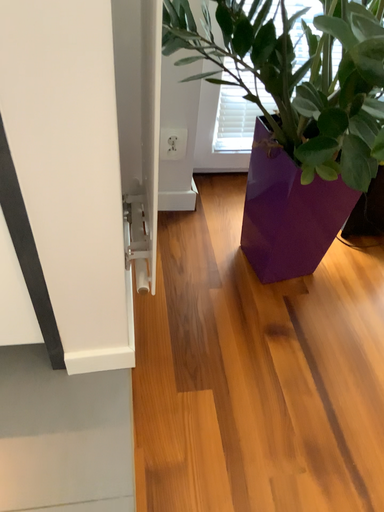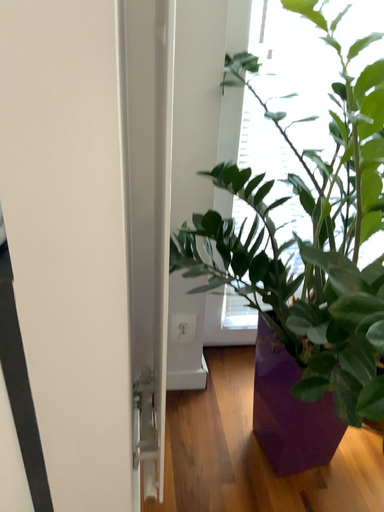
Question: Which way did the camera rotate in the video?

Choices:
 (A) rotated upward
 (B) rotated downward

Answer: (A)